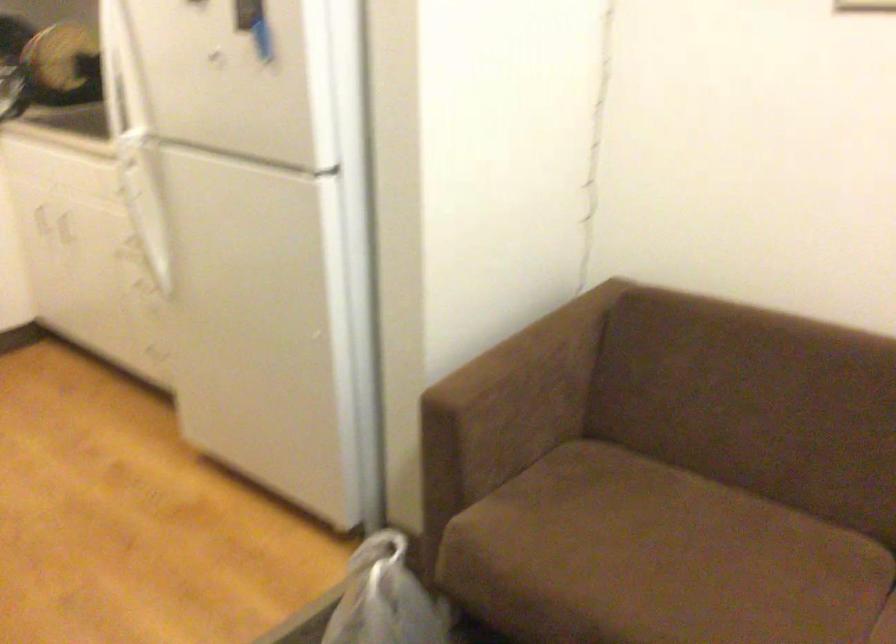
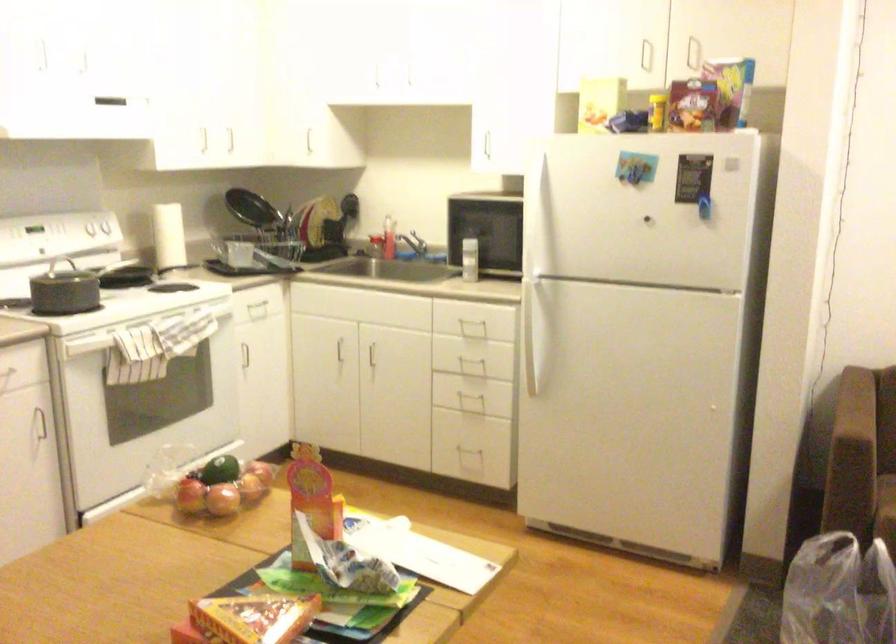
The images are taken continuously from a first-person perspective. In which direction are you moving?

The cameraman walked toward left, backward.